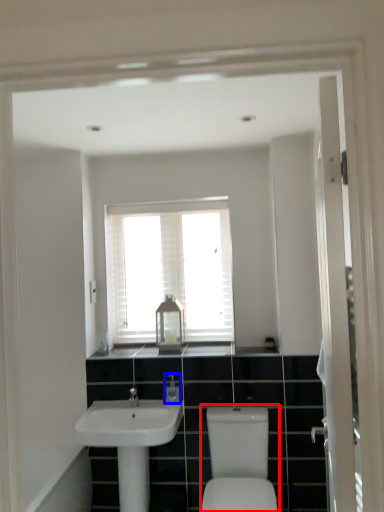
Question: Which object appears closest to the camera in this image, sink (highlighted by a red box) or toiletry (highlighted by a blue box)?

Choices:
 (A) sink
 (B) toiletry

Answer: (A)